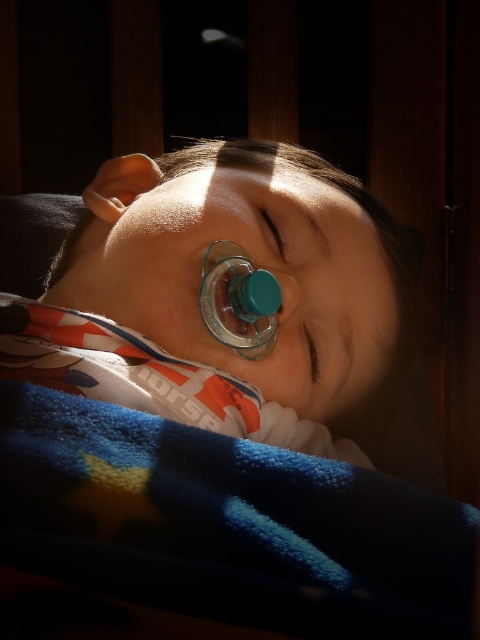
Between blue fleece blanket at lower left and matte plastic eye at center, which one appears on the right side from the viewer's perspective?

matte plastic eye at center

This screenshot has height=640, width=480. What do you see at coordinates (227, 524) in the screenshot?
I see `blue fleece blanket at lower left` at bounding box center [227, 524].

The image size is (480, 640). Find the location of `blue fleece blanket at lower left`. blue fleece blanket at lower left is located at coordinates (227, 524).

Does matte plastic eye at center appear on the right side of brown matte eye at center?

Incorrect, matte plastic eye at center is not on the right side of brown matte eye at center.

Image resolution: width=480 pixels, height=640 pixels. What do you see at coordinates (274, 228) in the screenshot?
I see `matte plastic eye at center` at bounding box center [274, 228].

Between point (280, 253) and point (308, 349), which one is positioned in front?

Point (280, 253) is more forward.

Locate an element on the screen. matte plastic eye at center is located at coordinates (274, 228).

Does matte plastic eye at center appear over translucent plastic pacifier at center?

Correct, matte plastic eye at center is located above translucent plastic pacifier at center.

Which is in front, point (266, 204) or point (299, 301)?

Point (299, 301) is in front.

The image size is (480, 640). I want to click on matte plastic eye at center, so click(274, 228).